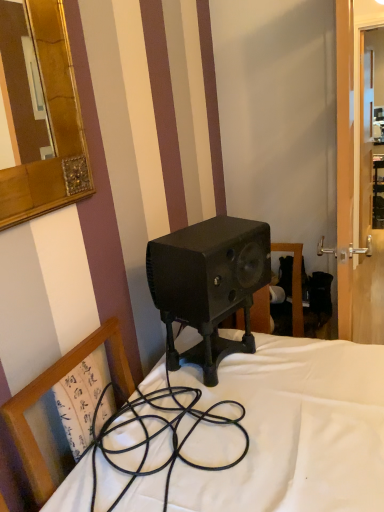
Question: From a real-world perspective, does transparent glass door at right stand above wooden chair at center?

Choices:
 (A) yes
 (B) no

Answer: (A)

Question: Is transparent glass door at right taller than wooden chair at center?

Choices:
 (A) no
 (B) yes

Answer: (B)

Question: From the image's perspective, would you say transparent glass door at right is shown under wooden chair at center?

Choices:
 (A) yes
 (B) no

Answer: (B)

Question: Is transparent glass door at right completely or partially outside of wooden chair at center?

Choices:
 (A) yes
 (B) no

Answer: (A)

Question: Is transparent glass door at right further to the viewer compared to wooden chair at center?

Choices:
 (A) no
 (B) yes

Answer: (B)

Question: Is transparent glass door at right shorter than wooden chair at center?

Choices:
 (A) yes
 (B) no

Answer: (B)

Question: Is wooden chair at center at the left side of matte black speaker at center?

Choices:
 (A) no
 (B) yes

Answer: (B)

Question: Considering the relative positions of wooden chair at center and matte black speaker at center in the image provided, is wooden chair at center to the right of matte black speaker at center from the viewer's perspective?

Choices:
 (A) yes
 (B) no

Answer: (B)

Question: Is wooden chair at center surrounding matte black speaker at center?

Choices:
 (A) no
 (B) yes

Answer: (A)

Question: From a real-world perspective, is wooden chair at center positioned over matte black speaker at center based on gravity?

Choices:
 (A) yes
 (B) no

Answer: (B)

Question: Would you say wooden chair at center is outside matte black speaker at center?

Choices:
 (A) yes
 (B) no

Answer: (A)

Question: Can you see wooden chair at center touching matte black speaker at center?

Choices:
 (A) no
 (B) yes

Answer: (A)

Question: Does matte black speaker at center have a larger size compared to transparent glass door at right?

Choices:
 (A) yes
 (B) no

Answer: (B)